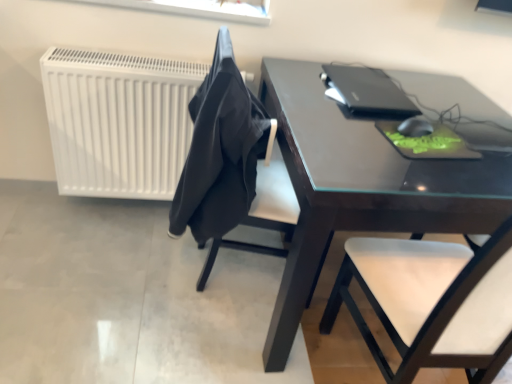
Identify the location of unoccupied area in front of black fabric chair at center. The image size is (512, 384). (204, 339).